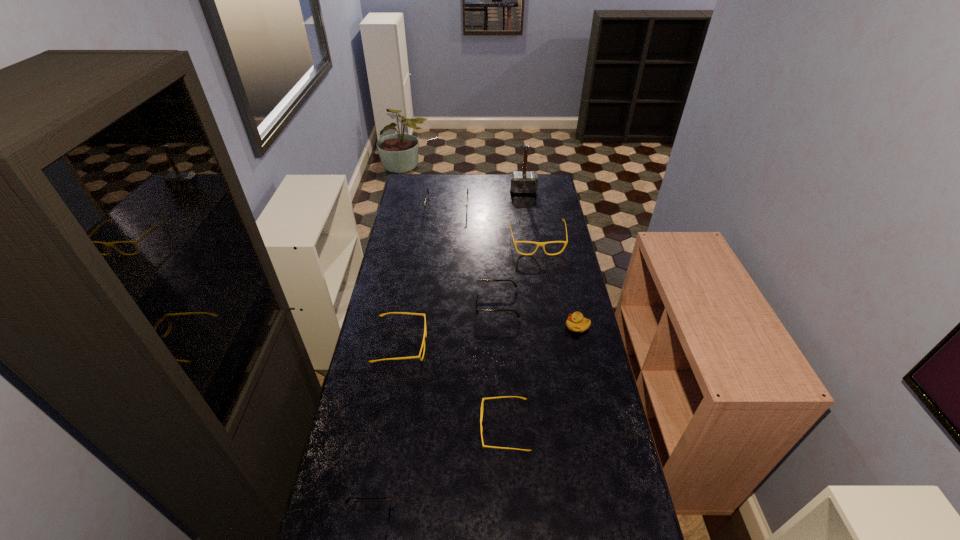
The image size is (960, 540). What are the coordinates of `duckling present at the right edge` in the screenshot? It's located at (576, 322).

Find the location of a particular element. Image resolution: width=960 pixels, height=540 pixels. object that is at the far left corner is located at coordinates (432, 210).

I want to click on object present at the far right corner, so click(523, 182).

You are a GUI agent. You are given a task and a screenshot of the screen. Output one action in this format:
    pyautogui.click(x=<x>, y=<y>)
    Task: Click on the vacant space at the far edge of the desktop
    
    Given the screenshot: What is the action you would take?
    pyautogui.click(x=504, y=187)

In the image, there is a desktop. What are the coordinates of `blank space at the left edge` in the screenshot? It's located at (419, 211).

I want to click on vacant space at the right edge of the desktop, so click(540, 212).

This screenshot has width=960, height=540. What are the coordinates of `vacant space at the far left corner of the desktop` in the screenshot? It's located at (430, 196).

This screenshot has width=960, height=540. What are the coordinates of `free point between the second nearest spectacles and the third nearest spectacles` in the screenshot? It's located at (453, 387).

Identify the location of vacant area that lies between the fourth nearest spectacles and the farthest object. This screenshot has height=540, width=960. (510, 247).

Identify the location of free space between the farthest beige spectacles and the yellow duckling. (558, 284).